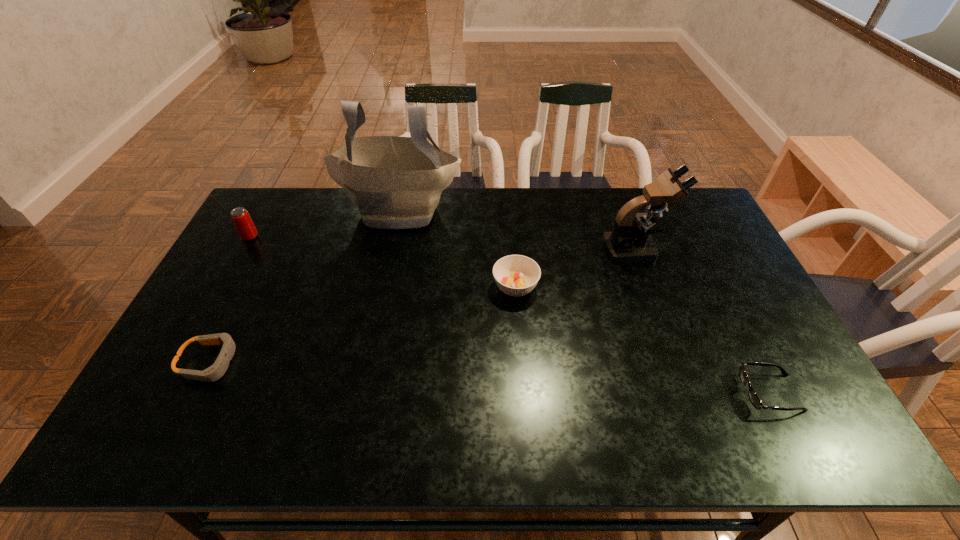
Find the location of a particular element. The height and width of the screenshot is (540, 960). the tallest object is located at coordinates (396, 182).

Image resolution: width=960 pixels, height=540 pixels. I want to click on the farthest object, so click(396, 182).

Locate an element on the screen. This screenshot has height=540, width=960. microscope is located at coordinates (630, 241).

Find the location of a particular element. the second tallest object is located at coordinates (630, 241).

You are a GUI agent. You are given a task and a screenshot of the screen. Output one action in this format:
    pyautogui.click(x=<x>, y=<y>)
    Task: Click on the beer can
    This screenshot has height=540, width=960.
    Given the screenshot: What is the action you would take?
    pyautogui.click(x=240, y=216)

This screenshot has width=960, height=540. Identify the location of soup bowl. (516, 275).

At what (x,y) coordinates should I click in order to perform the action: click on the third nearest object. Please return your answer as a coordinate pair (x, y). Looking at the image, I should click on (516, 275).

The width and height of the screenshot is (960, 540). I want to click on spectacles, so click(754, 399).

Locate an element on the screen. The width and height of the screenshot is (960, 540). goggles is located at coordinates pos(217,370).

Where is `vacant region located 0.110m on the left of the tallest object`? vacant region located 0.110m on the left of the tallest object is located at coordinates (305, 210).